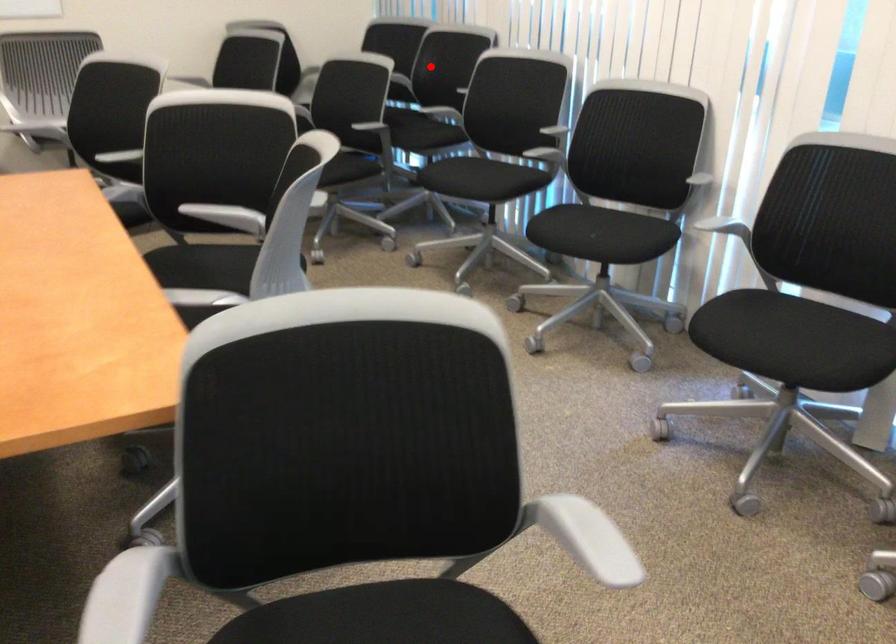
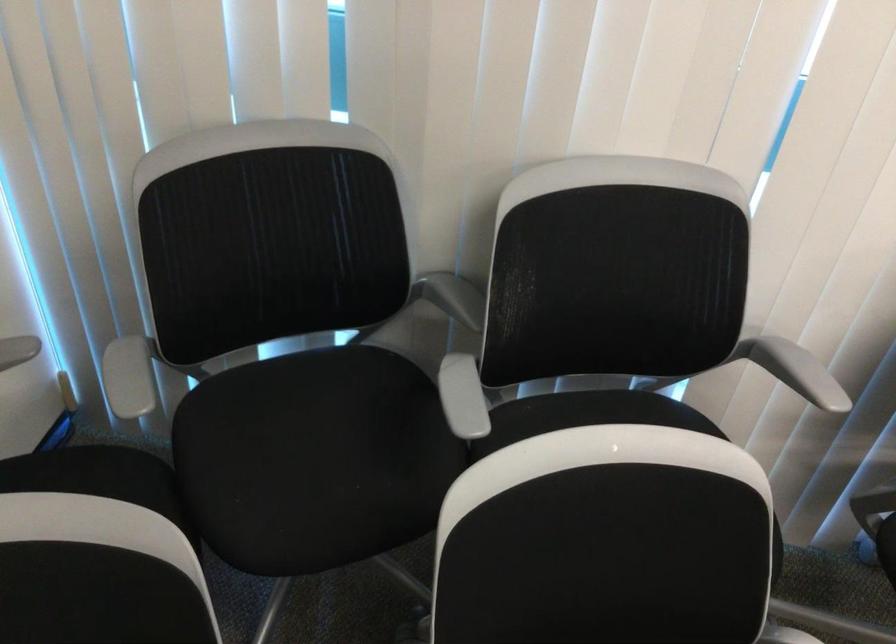
In the second image, find the point that corresponds to the highlighted location in the first image.

(453, 297)